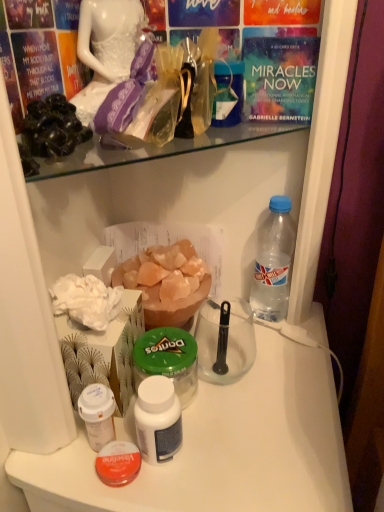
You are a GUI agent. You are given a task and a screenshot of the screen. Output one action in this format:
    pyautogui.click(x=<x>, y=<y>)
    Task: Click on the vacant area that is situated to the right of pink crystal salt at center
    This screenshot has height=512, width=384.
    Given the screenshot: What is the action you would take?
    pyautogui.click(x=264, y=344)